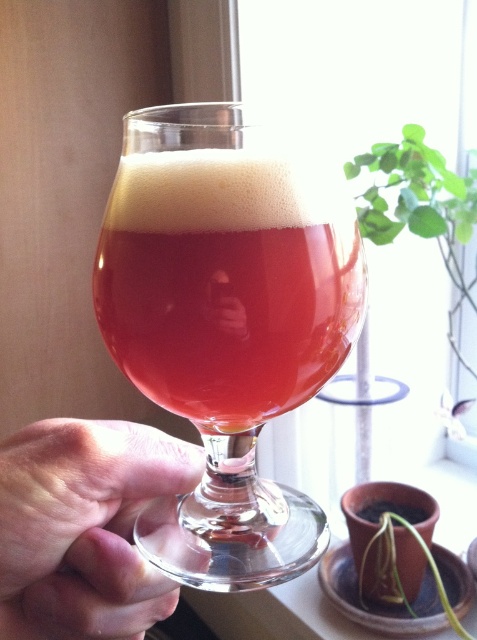
What is the exact coordinate of the transparent glass at center?

The transparent glass at center is located at coordinate point [226,324].

You are a bartender preparing a drink. You have a transparent glass at center and a green leafy plant at upper right nearby. Which object is thinner?

The transparent glass at center is thinner than the green leafy plant at upper right.

You are arranging flowers in a room and see two green leafy plants. One is the green leafy plant at upper right and the other is the green leafy plant at lower right. Which one is positioned to the right side of the other?

The green leafy plant at upper right is positioned to the right of the green leafy plant at lower right.